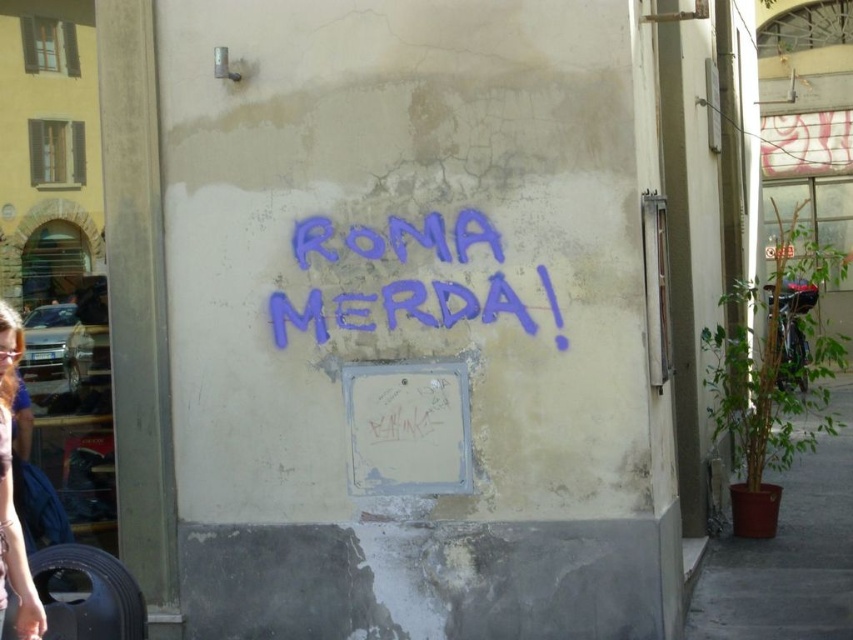
Can you confirm if purple spray paint graffiti at center is positioned above matte purple shirt at lower left?

Indeed, purple spray paint graffiti at center is positioned over matte purple shirt at lower left.

Does point (317, 218) come behind point (0, 588)?

Yes, point (317, 218) is farther from viewer.

This screenshot has width=853, height=640. Describe the element at coordinates (453, 301) in the screenshot. I see `purple spray paint graffiti at center` at that location.

The height and width of the screenshot is (640, 853). I want to click on purple spray paint graffiti at center, so [x=453, y=301].